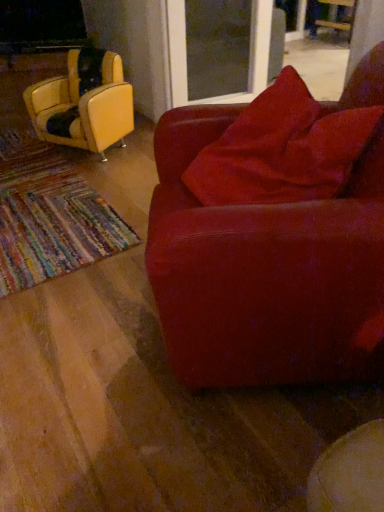
Question: From a real-world perspective, is transparent glass screen door at upper center physically located above or below wooden chair at upper right, acting as the 3th chair starting from the left?

Choices:
 (A) below
 (B) above

Answer: (B)

Question: Looking at the image, does transparent glass screen door at upper center seem bigger or smaller compared to wooden chair at upper right, the first chair from the back?

Choices:
 (A) small
 (B) big

Answer: (B)

Question: Based on their relative distances, which object is nearer to the wooden chair at upper right, acting as the 3th chair starting from the left?

Choices:
 (A) transparent glass screen door at upper center
 (B) suede-like red couch at center, which ranks as the second chair in left-to-right order
 (C) leather yellow chair at left, the 2th chair positioned from the top

Answer: (A)

Question: Estimate the real-world distances between objects in this image. Which object is closer to the wooden chair at upper right, the first chair from the top?

Choices:
 (A) transparent glass screen door at upper center
 (B) suede-like red couch at center, which is the 3th chair in back-to-front order
 (C) leather yellow chair at left, placed as the 2th chair when sorted from back to front

Answer: (A)